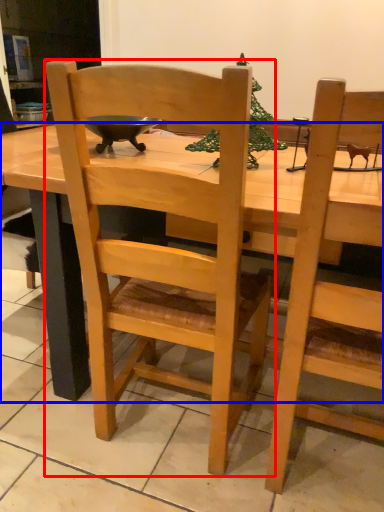
Question: Which object is closer to the camera taking this photo, chair (highlighted by a red box) or desk (highlighted by a blue box)?

Choices:
 (A) chair
 (B) desk

Answer: (A)